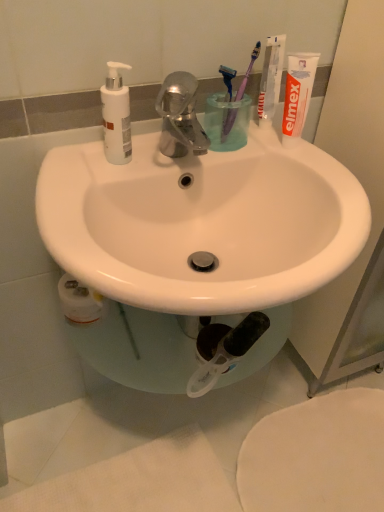
The width and height of the screenshot is (384, 512). In order to click on vacant space to the right of transparent plastic cup at center in this screenshot , I will do `click(284, 154)`.